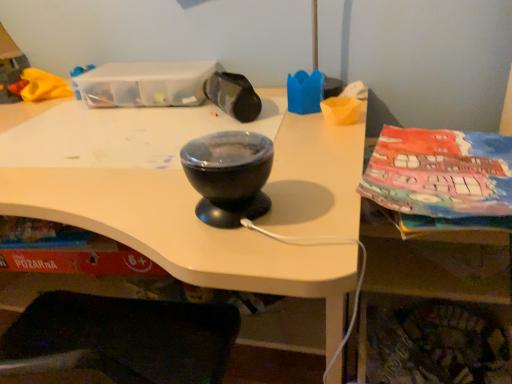
Question: Considering the relative positions of black glossy bowl at center and matte black bowl at center in the image provided, is black glossy bowl at center to the left of matte black bowl at center from the viewer's perspective?

Choices:
 (A) yes
 (B) no

Answer: (A)

Question: From the image's perspective, is black glossy bowl at center over matte black bowl at center?

Choices:
 (A) no
 (B) yes

Answer: (A)

Question: From a real-world perspective, is black glossy bowl at center physically above matte black bowl at center?

Choices:
 (A) yes
 (B) no

Answer: (B)

Question: Does black glossy bowl at center have a smaller size compared to matte black bowl at center?

Choices:
 (A) no
 (B) yes

Answer: (A)

Question: From the image's perspective, is black glossy bowl at center under matte black bowl at center?

Choices:
 (A) yes
 (B) no

Answer: (A)

Question: Can you confirm if black glossy bowl at center is bigger than matte black bowl at center?

Choices:
 (A) yes
 (B) no

Answer: (A)

Question: Does matte black bowl at center appear on the left side of black glossy bowl at center?

Choices:
 (A) yes
 (B) no

Answer: (B)

Question: Does matte black bowl at center turn towards black glossy bowl at center?

Choices:
 (A) no
 (B) yes

Answer: (A)

Question: Can you confirm if matte black bowl at center is taller than black glossy bowl at center?

Choices:
 (A) no
 (B) yes

Answer: (A)

Question: Is matte black bowl at center far from black glossy bowl at center?

Choices:
 (A) yes
 (B) no

Answer: (B)

Question: From a real-world perspective, is matte black bowl at center located beneath black glossy bowl at center?

Choices:
 (A) yes
 (B) no

Answer: (B)

Question: Does matte black bowl at center have a lesser height compared to black glossy bowl at center?

Choices:
 (A) no
 (B) yes

Answer: (B)

Question: From the image's perspective, is black glossy bowl at center located above or below matte black bowl at center?

Choices:
 (A) above
 (B) below

Answer: (B)